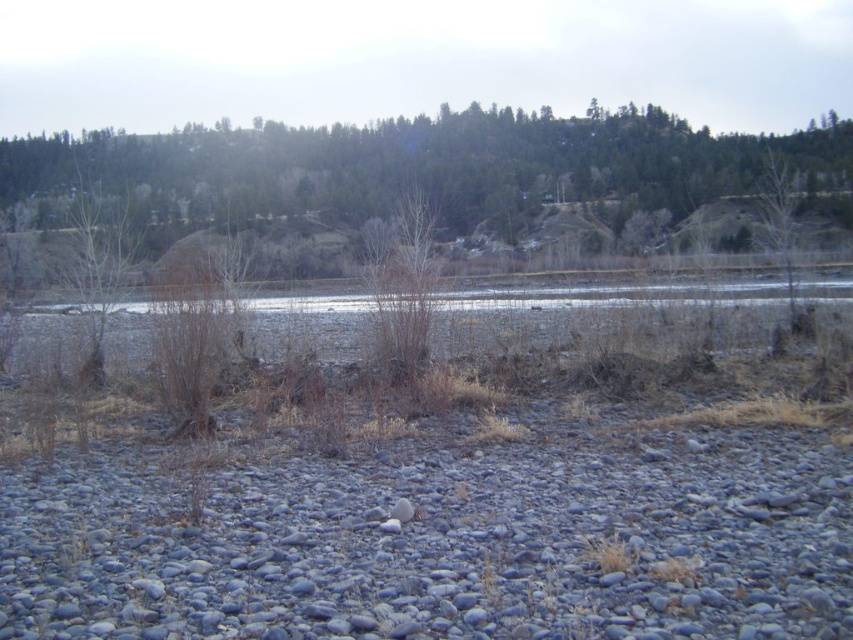
Question: Is brown/dry grass at left thinner than brown textured tree at right?

Choices:
 (A) yes
 (B) no

Answer: (B)

Question: Is brown/dry grass at left to the right of brown textured tree at right from the viewer's perspective?

Choices:
 (A) no
 (B) yes

Answer: (A)

Question: Can you confirm if brown/dry grass at left is positioned to the left of brown textured tree at right?

Choices:
 (A) yes
 (B) no

Answer: (A)

Question: Which point is farther to the camera?

Choices:
 (A) (782, 243)
 (B) (94, 362)

Answer: (A)

Question: Which object is closer to the camera taking this photo?

Choices:
 (A) brown textured tree at right
 (B) brown/dry grass at left

Answer: (B)